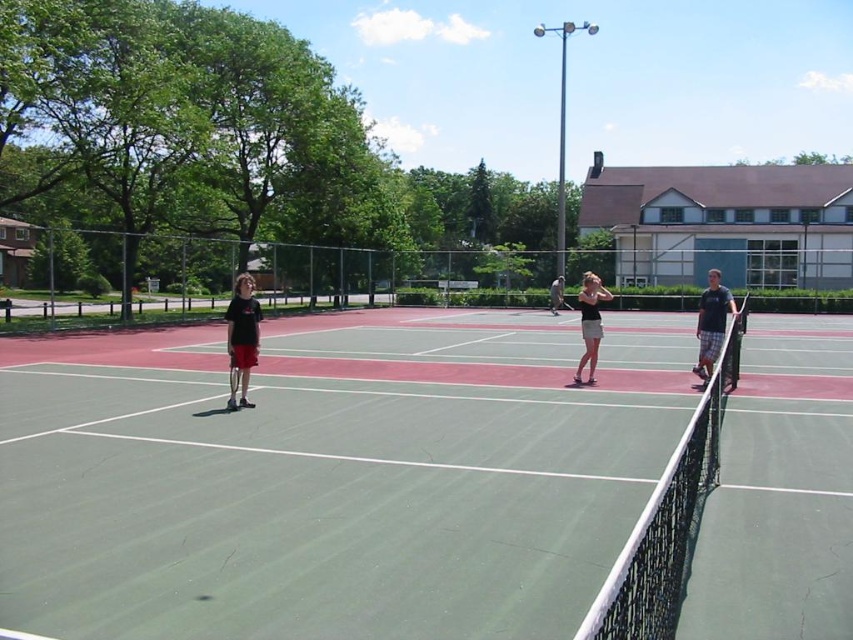
You are a tennis player preparing to serve. You notice the white mesh net at center and the matte black shorts at left. Which object is wider?

The white mesh net at center is wider than the matte black shorts at left.

You are standing at the point marked as point (589,632) on the tennis court. The net is located between you and the building in the background. Can you safely walk straight to the fence without crossing the net?

The distance between you and the viewer is 1.89 meters. Since the net is between you and the building, walking straight would require crossing the net, which is in the path. Therefore, you cannot walk straight to the fence without crossing the net.